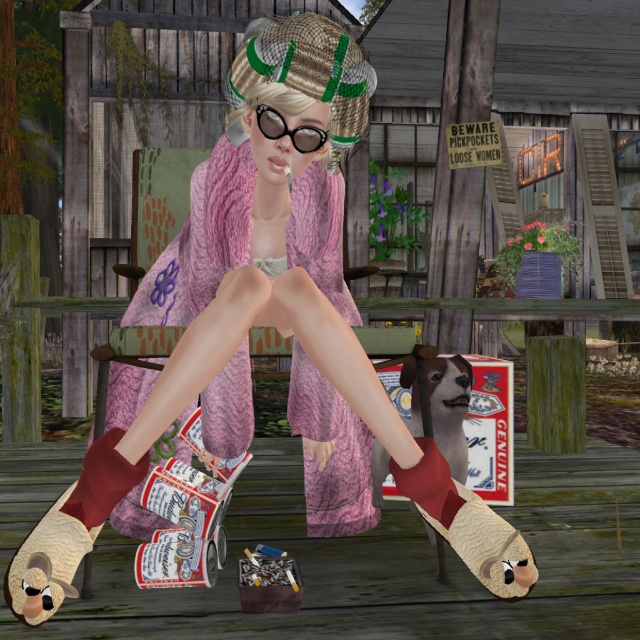
Is pink knitted dress at center positioned behind burgundy knitted sock at lower left?

Yes, it is behind burgundy knitted sock at lower left.

Can you confirm if pink knitted dress at center is bigger than burgundy knitted sock at lower left?

Indeed, pink knitted dress at center has a larger size compared to burgundy knitted sock at lower left.

Locate an element on the screen. Image resolution: width=640 pixels, height=640 pixels. pink knitted dress at center is located at coordinates point(202,241).

Does beige suede shoe at lower left have a lesser width compared to burgundy knitted sock at lower left?

In fact, beige suede shoe at lower left might be wider than burgundy knitted sock at lower left.

I want to click on beige suede shoe at lower left, so click(48, 563).

Between point (38, 572) and point (92, 525), which one is positioned behind?

Point (92, 525)

Locate an element on the screen. The image size is (640, 640). beige suede shoe at lower left is located at coordinates (48, 563).

What do you see at coordinates (467, 524) in the screenshot? I see `leather/textured shoe at lower center` at bounding box center [467, 524].

Does leather/textured shoe at lower center appear on the left side of beige suede shoe at lower left?

In fact, leather/textured shoe at lower center is to the right of beige suede shoe at lower left.

Which is in front, point (461, 492) or point (68, 524)?

Positioned in front is point (68, 524).

Where is `leather/textured shoe at lower center`? This screenshot has height=640, width=640. leather/textured shoe at lower center is located at coordinates (467, 524).